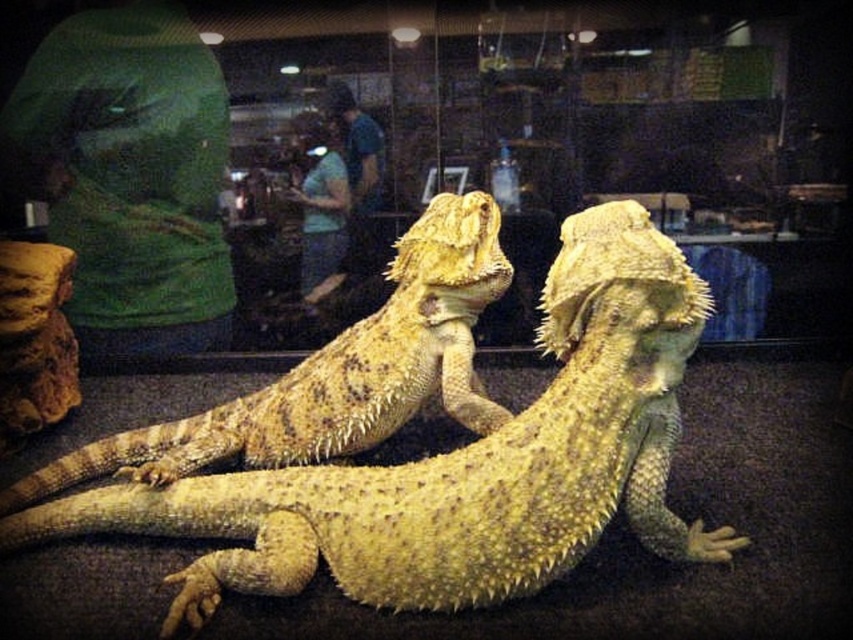
Where is `yellow scaly lizard at center`? yellow scaly lizard at center is located at coordinates (463, 464).

Is point (430, 605) closer to viewer compared to point (229, 406)?

Yes, point (430, 605) is closer to viewer.

Locate an element on the screen. The width and height of the screenshot is (853, 640). yellow scaly lizard at center is located at coordinates (463, 464).